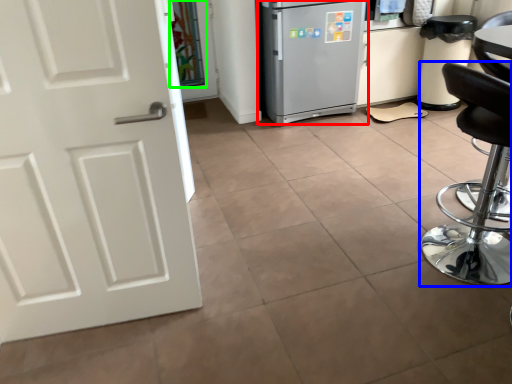
Question: Estimate the real-world distances between objects in this image. Which object is farther from refrigerator (highlighted by a red box), chair (highlighted by a blue box) or glass door (highlighted by a green box)?

Choices:
 (A) chair
 (B) glass door

Answer: (A)